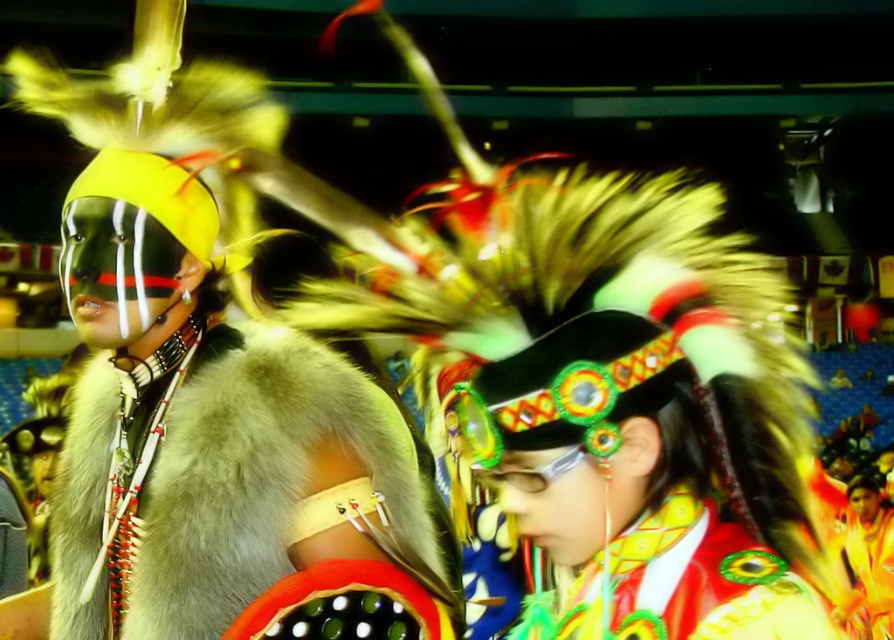
Is fur at left behind shiny yellow fabric headdress at center?

Yes, it is behind shiny yellow fabric headdress at center.

Can you confirm if fur at left is wider than shiny yellow fabric headdress at center?

Incorrect, fur at left's width does not surpass shiny yellow fabric headdress at center's.

Is point (120, 378) farther from camera compared to point (783, 563)?

Yes, it is behind point (783, 563).

Find the location of a particular element. This screenshot has height=640, width=894. fur at left is located at coordinates (243, 499).